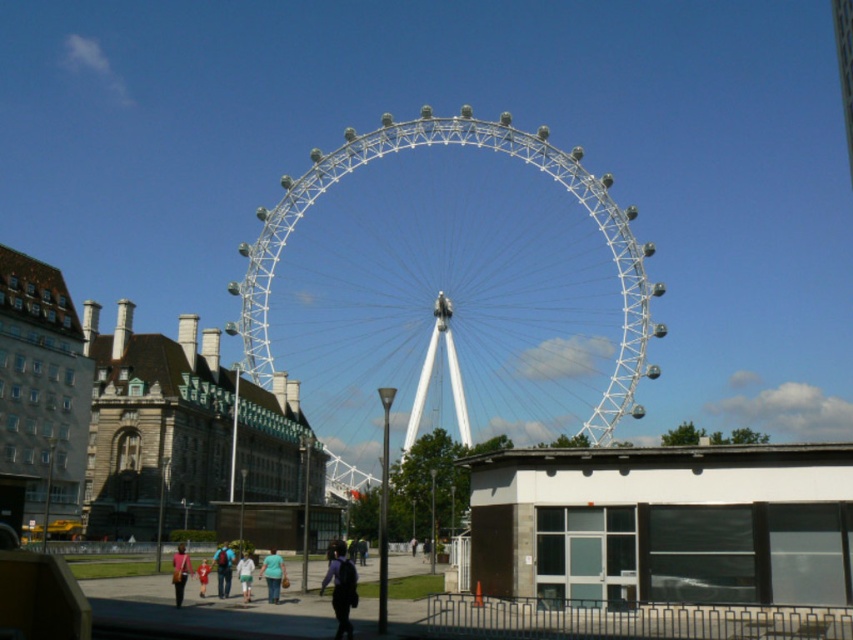
In the scene shown: You are standing at the entrance of the smaller building and want to reach the Ferris wheel. There are two points marked on the path ahead of you. The first point is at coordinates point (412, 436) and the second is at point (338, 547). According to the spatial relationship between these points, which point should you head towards first to reach the Ferris wheel?

Point (338, 547) should be headed towards first because it is in front of point (412, 436), meaning it is closer to you and the Ferris wheel is beyond it.

You are standing at the entrance of the smaller building with a mix of brick and glass. You want to find the light blue shirt at center. Based on the coordinates provided, in which direction should you look to locate it?

The light blue shirt at center is located at coordinates point (223, 568), so you should look towards the upper right direction from your current position at the entrance of the smaller building with a mix of brick and glass.

You are a fashion designer observing the urban scene at the London Eye. You notice a person wearing light blue jeans at center and a red cotton shirt at lower center. Which clothing item appears narrower in width?

The light blue jeans at center appears narrower in width than the red cotton shirt at lower center because the light blue jeans at center has a smaller width according to the description.